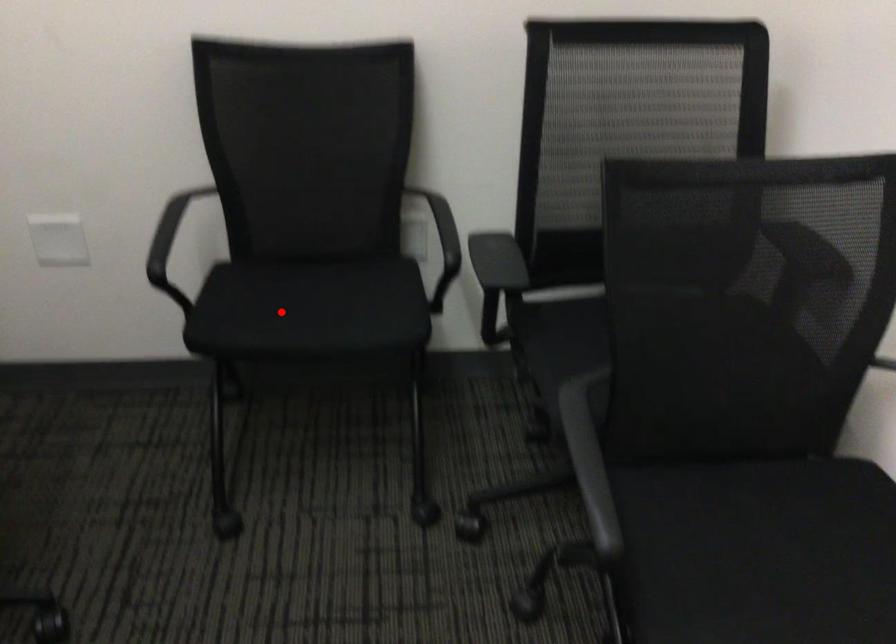
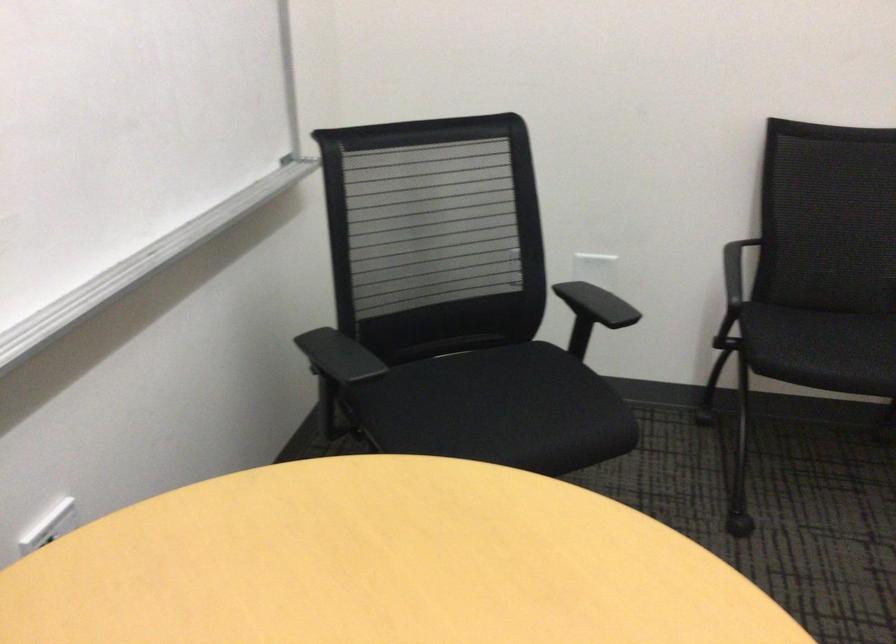
Question: I am providing you with two images of the same scene from different viewpoints. Given a red point in image1, look at the same physical point in image2. Is it:

Choices:
 (A) Closer to the viewpoint
 (B) Farther from the viewpoint

Answer: (B)